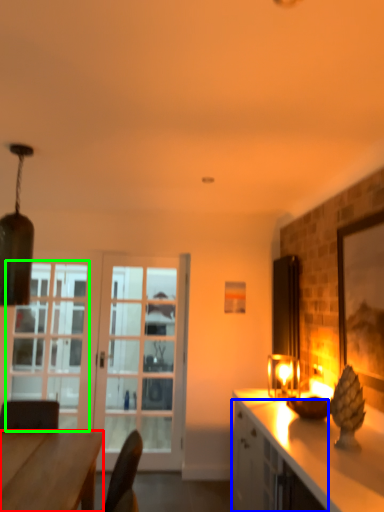
Question: Considering the real-world distances, which object is closest to desk (highlighted by a red box)? cabinetry (highlighted by a blue box) or window (highlighted by a green box).

Choices:
 (A) cabinetry
 (B) window

Answer: (A)